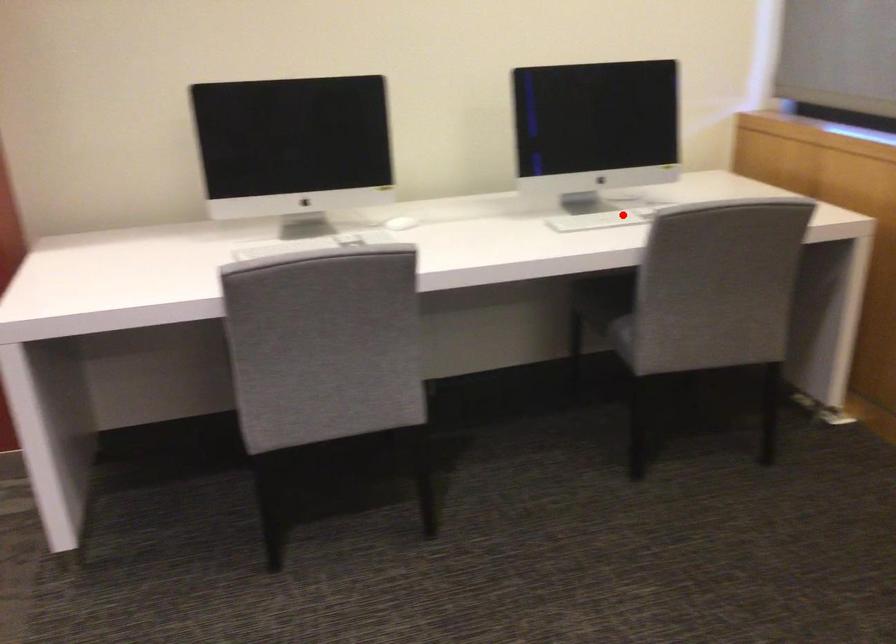
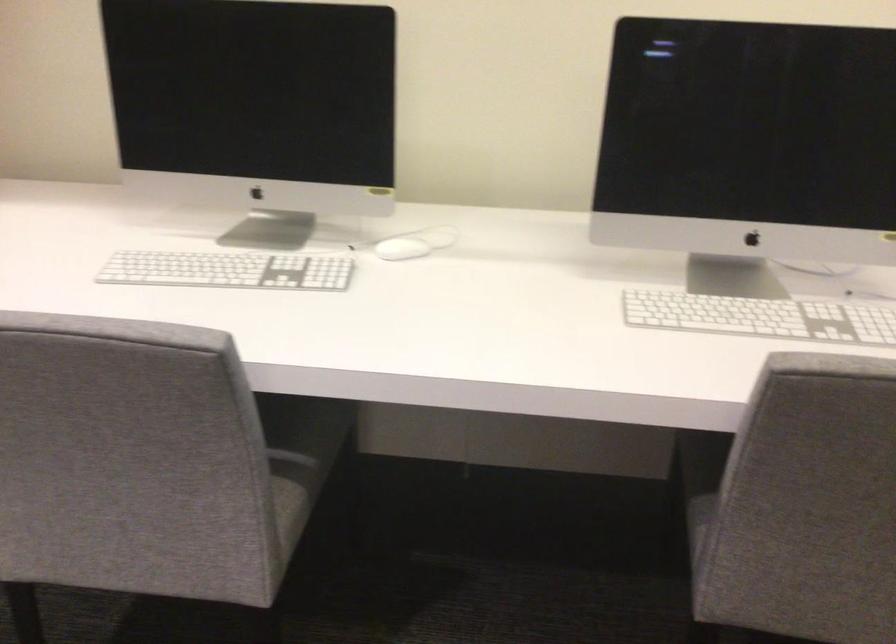
In the second image, find the point that corresponds to the highlighted location in the first image.

(760, 317)